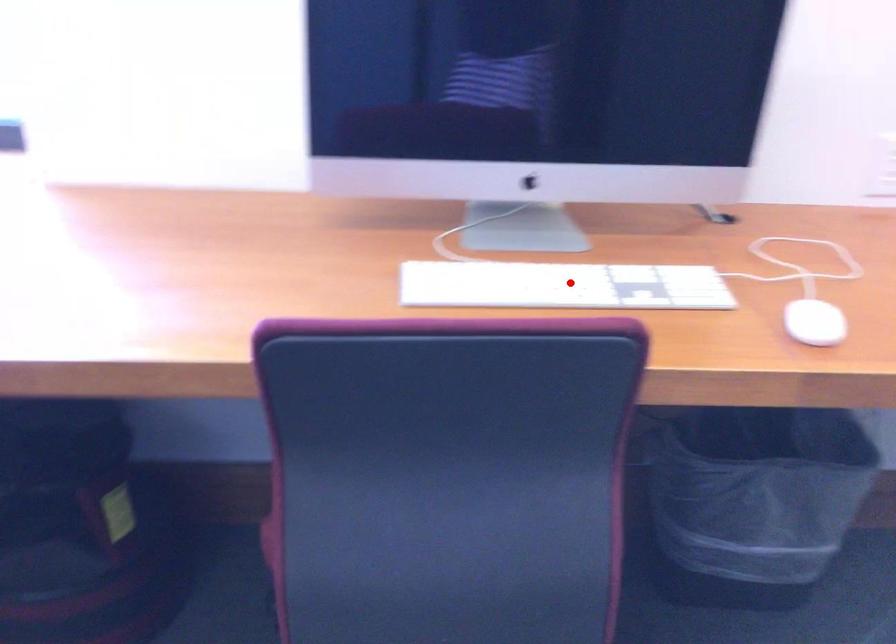
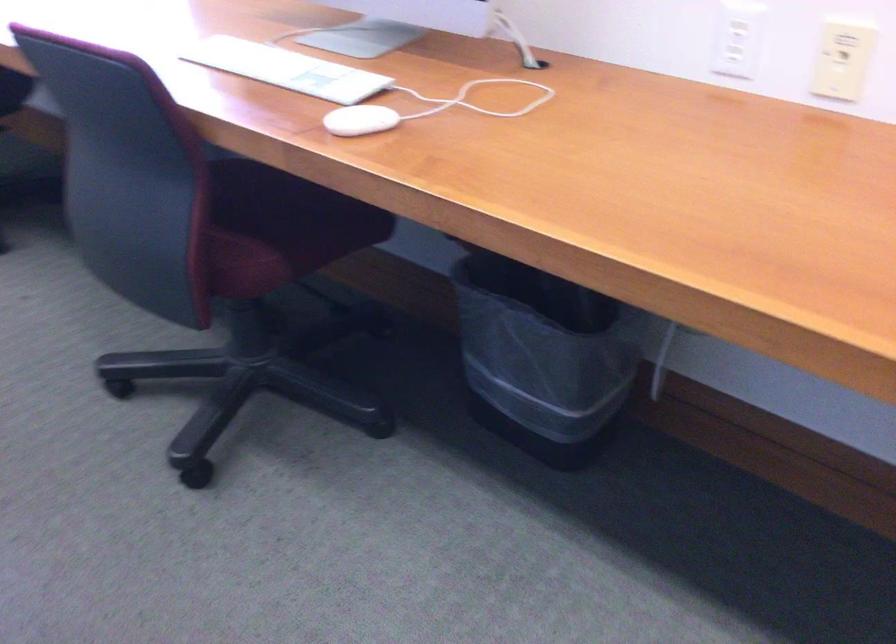
The point at the highlighted location is marked in the first image. Where is the corresponding point in the second image?

(286, 69)